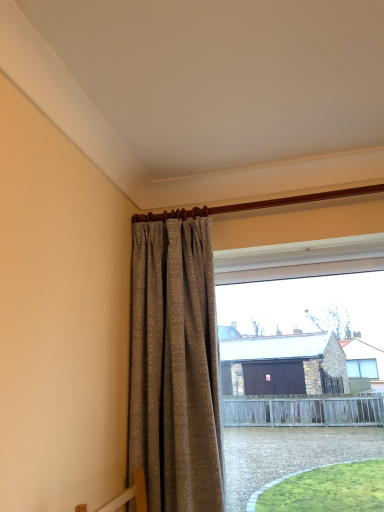
Question: Which is correct: transparent glass window at center is inside beige textured curtain at center, or outside of it?

Choices:
 (A) outside
 (B) inside

Answer: (A)

Question: Is point (299, 310) positioned closer to the camera than point (170, 279)?

Choices:
 (A) farther
 (B) closer

Answer: (A)

Question: Is transparent glass window at center bigger or smaller than beige textured curtain at center?

Choices:
 (A) small
 (B) big

Answer: (B)

Question: From a real-world perspective, is beige textured curtain at center positioned above or below transparent glass window at center?

Choices:
 (A) above
 (B) below

Answer: (A)

Question: Relative to transparent glass window at center, is beige textured curtain at center in front or behind?

Choices:
 (A) behind
 (B) front

Answer: (B)

Question: From their relative heights in the image, would you say beige textured curtain at center is taller or shorter than transparent glass window at center?

Choices:
 (A) short
 (B) tall

Answer: (B)

Question: Considering the positions of point click(213, 372) and point click(254, 407), is point click(213, 372) closer or farther from the camera than point click(254, 407)?

Choices:
 (A) farther
 (B) closer

Answer: (B)